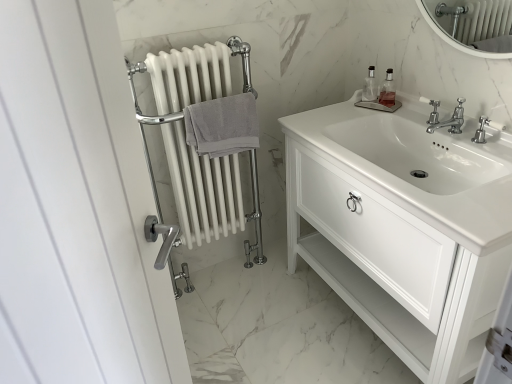
Question: In terms of width, does clear glass soap dispenser at upper right, placed as the 1th soap dispenser when sorted from left to right, look wider or thinner when compared to white glossy cabinet at center?

Choices:
 (A) wide
 (B) thin

Answer: (B)

Question: Considering the positions of clear glass soap dispenser at upper right, placed as the 1th soap dispenser when sorted from left to right, and white glossy cabinet at center in the image, is clear glass soap dispenser at upper right, placed as the 1th soap dispenser when sorted from left to right, taller or shorter than white glossy cabinet at center?

Choices:
 (A) short
 (B) tall

Answer: (A)

Question: Estimate the real-world distances between objects in this image. Which object is farther from the gray cotton towel at center-left?

Choices:
 (A) clear glass soap dispenser at upper right, arranged as the 2th soap dispenser when viewed from the left
 (B) clear glass soap dispenser at upper right, placed as the 1th soap dispenser when sorted from left to right
 (C) white glossy cabinet at center
 (D) polished chrome faucet at center

Answer: (D)

Question: Estimate the real-world distances between objects in this image. Which object is farther from the polished chrome faucet at center?

Choices:
 (A) gray cotton towel at center-left
 (B) white glossy cabinet at center
 (C) clear glass soap dispenser at upper right, arranged as the 2th soap dispenser when viewed from the left
 (D) clear glass soap dispenser at upper right, placed as the 1th soap dispenser when sorted from left to right

Answer: (A)